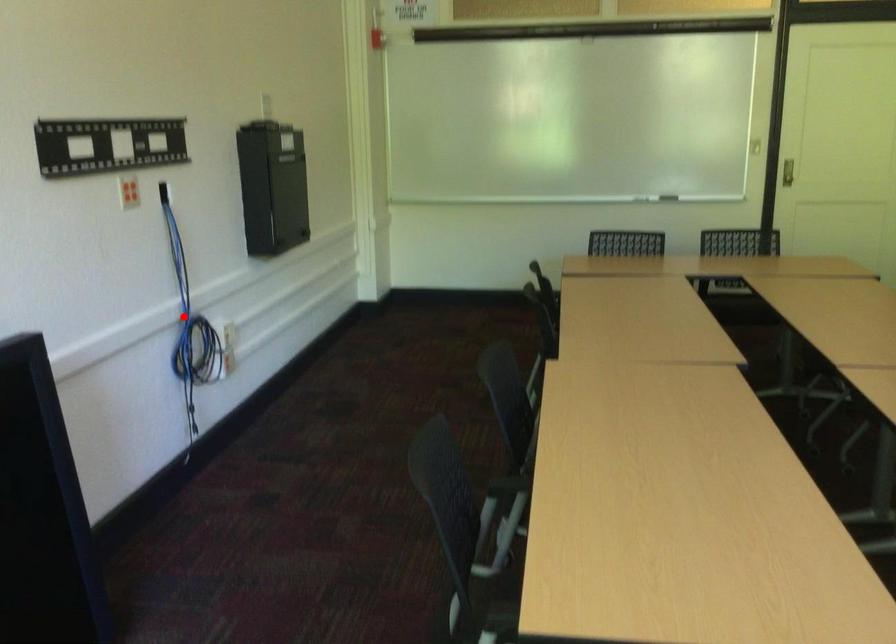
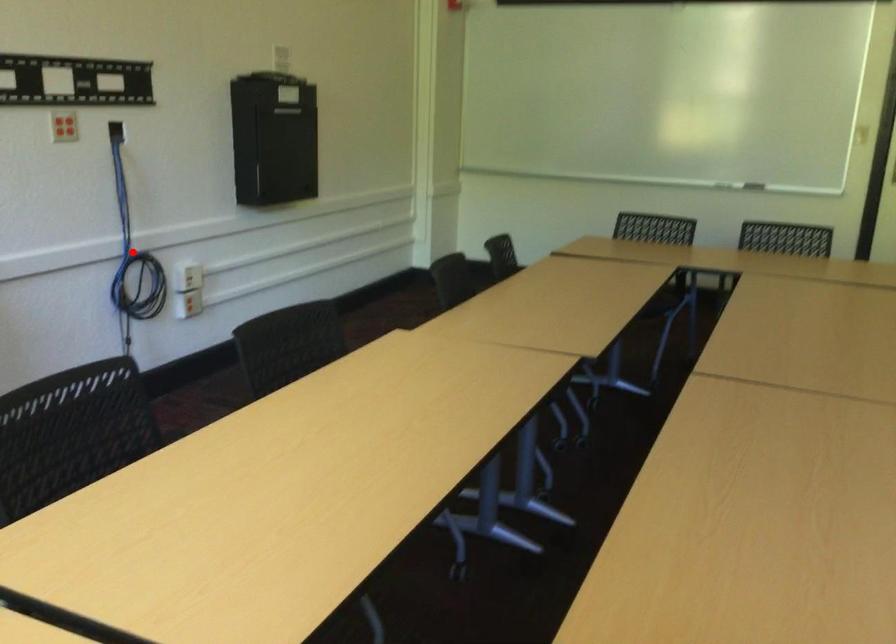
I am providing you with two images of the same scene from different viewpoints. A red point is marked on the first image and another point is marked on the second image. Is the marked point in image1 the same physical position as the marked point in image2?

Yes